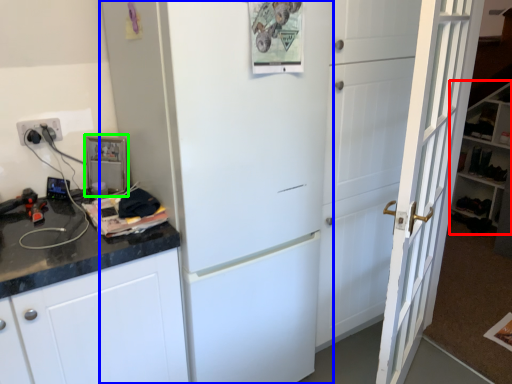
Question: Based on their relative distances, which object is nearer to bookshelf (highlighted by a red box)? Choose from refrigerator (highlighted by a blue box) and appliance (highlighted by a green box).

Choices:
 (A) refrigerator
 (B) appliance

Answer: (A)